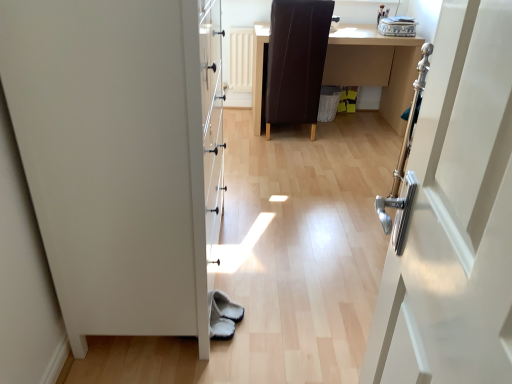
Question: Does white matte door at left turn towards brown leather chair at center?

Choices:
 (A) yes
 (B) no

Answer: (B)

Question: From the image's perspective, does white matte door at left appear higher than brown leather chair at center?

Choices:
 (A) no
 (B) yes

Answer: (A)

Question: Is white matte door at left positioned in front of brown leather chair at center?

Choices:
 (A) no
 (B) yes

Answer: (B)

Question: Considering the relative sizes of white matte door at left and brown leather chair at center in the image provided, is white matte door at left wider than brown leather chair at center?

Choices:
 (A) no
 (B) yes

Answer: (A)

Question: Would you say white matte door at left contains brown leather chair at center?

Choices:
 (A) yes
 (B) no

Answer: (B)

Question: Is white matte door at left taller than brown leather chair at center?

Choices:
 (A) yes
 (B) no

Answer: (A)

Question: Does white matte door at left have a lesser height compared to brown leather desk at center?

Choices:
 (A) no
 (B) yes

Answer: (A)

Question: Can you see white matte door at left touching brown leather desk at center?

Choices:
 (A) yes
 (B) no

Answer: (B)

Question: Is white matte door at left positioned far away from brown leather desk at center?

Choices:
 (A) yes
 (B) no

Answer: (A)

Question: Does white matte door at left come in front of brown leather desk at center?

Choices:
 (A) no
 (B) yes

Answer: (B)

Question: Can you confirm if white matte door at left is bigger than brown leather desk at center?

Choices:
 (A) yes
 (B) no

Answer: (A)

Question: Is white matte door at left oriented away from brown leather desk at center?

Choices:
 (A) yes
 (B) no

Answer: (B)

Question: Is brown leather desk at center not within brown leather chair at center?

Choices:
 (A) no
 (B) yes

Answer: (B)